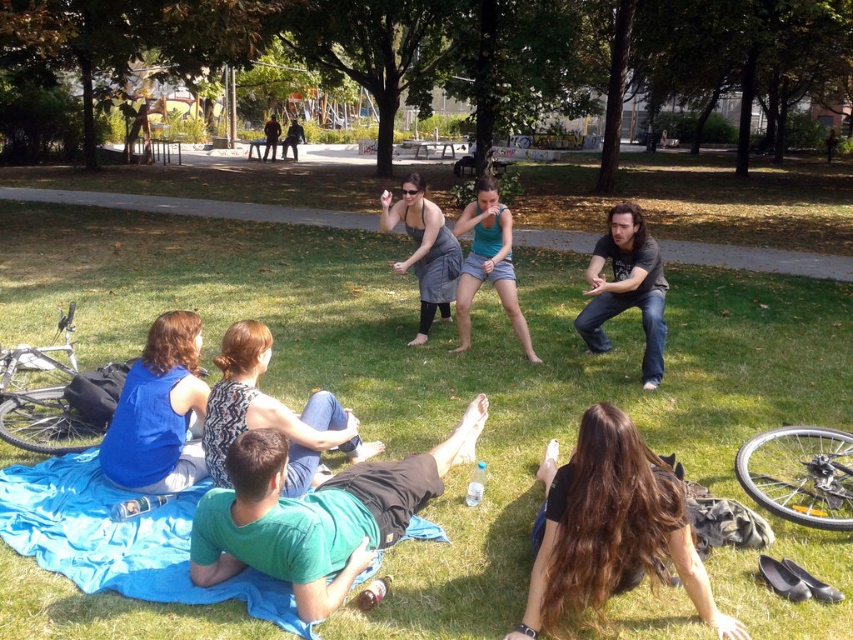
Does green grass at center have a greater height compared to black leather shoes at lower right?

Yes.

Does point (769, 602) lie in front of point (630, 426)?

No, (769, 602) is behind (630, 426).

Does point (799, 381) lie behind point (700, 579)?

That is True.

Where is `green grass at center`? This screenshot has height=640, width=853. green grass at center is located at coordinates (440, 365).

Based on the photo, does green grass at center come behind blue fabric at lower left?

No.

Can you confirm if green grass at center is wider than blue fabric at lower left?

Yes.

Between point (224, 624) and point (206, 474), which one is positioned in front?

Positioned in front is point (224, 624).

You are a GUI agent. You are given a task and a screenshot of the screen. Output one action in this format:
    pyautogui.click(x=<x>, y=<y>)
    Task: Click on the green grass at center
    
    Given the screenshot: What is the action you would take?
    pyautogui.click(x=440, y=365)

Between point (299, 484) and point (267, 125), which one is positioned behind?

The point (267, 125) is more distant.

Is point (300, 436) more distant than point (265, 148)?

That is False.

This screenshot has width=853, height=640. What are the coordinates of `printed fabric dress at center` in the screenshot? It's located at (271, 412).